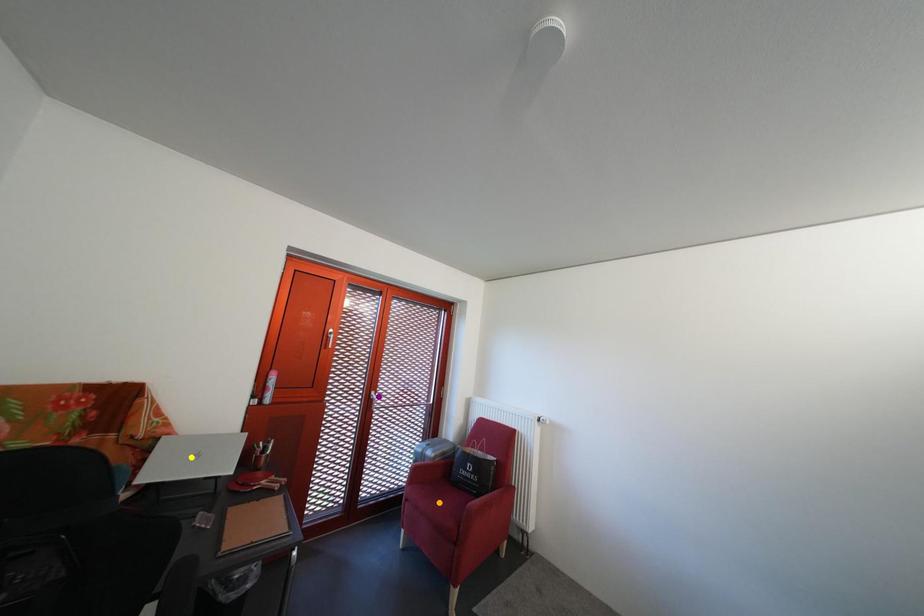
Order these from nearest to farthest:
orange point, yellow point, purple point

yellow point → orange point → purple point